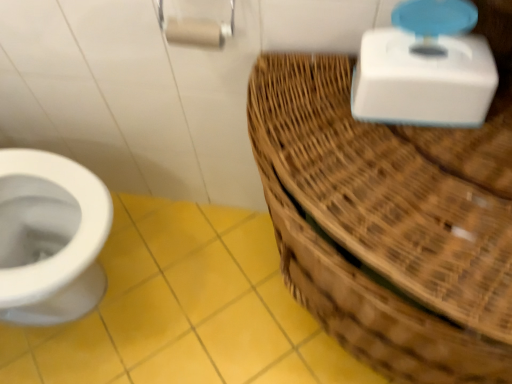
Question: From a real-world perspective, is white plastic scale at upper right located higher than yellow matte tile at lower left?

Choices:
 (A) yes
 (B) no

Answer: (A)

Question: Does white plastic scale at upper right appear on the left side of yellow matte tile at lower left?

Choices:
 (A) no
 (B) yes

Answer: (A)

Question: From a real-world perspective, is white plastic scale at upper right below yellow matte tile at lower left?

Choices:
 (A) no
 (B) yes

Answer: (A)

Question: Is white plastic scale at upper right bigger than yellow matte tile at lower left?

Choices:
 (A) no
 (B) yes

Answer: (A)

Question: Is white plastic scale at upper right oriented towards yellow matte tile at lower left?

Choices:
 (A) yes
 (B) no

Answer: (B)

Question: Considering the positions of yellow matte tile at lower left and woven brown basket at right in the image, is yellow matte tile at lower left wider or thinner than woven brown basket at right?

Choices:
 (A) thin
 (B) wide

Answer: (B)

Question: Relative to woven brown basket at right, is yellow matte tile at lower left in front or behind?

Choices:
 (A) behind
 (B) front

Answer: (A)

Question: From the image's perspective, is yellow matte tile at lower left positioned above or below woven brown basket at right?

Choices:
 (A) below
 (B) above

Answer: (A)

Question: Is yellow matte tile at lower left taller or shorter than woven brown basket at right?

Choices:
 (A) tall
 (B) short

Answer: (B)

Question: Is woven brown basket at right bigger or smaller than white plastic scale at upper right?

Choices:
 (A) small
 (B) big

Answer: (B)

Question: From a real-world perspective, is woven brown basket at right positioned above or below white plastic scale at upper right?

Choices:
 (A) above
 (B) below

Answer: (B)

Question: From the image's perspective, is woven brown basket at right positioned above or below white plastic scale at upper right?

Choices:
 (A) below
 (B) above

Answer: (A)

Question: Would you say woven brown basket at right is inside or outside white plastic scale at upper right?

Choices:
 (A) outside
 (B) inside

Answer: (A)

Question: From their relative heights in the image, would you say white plastic scale at upper right is taller or shorter than woven brown basket at right?

Choices:
 (A) tall
 (B) short

Answer: (B)

Question: In terms of size, does white plastic scale at upper right appear bigger or smaller than woven brown basket at right?

Choices:
 (A) small
 (B) big

Answer: (A)